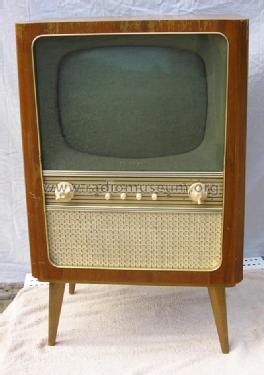
The image size is (264, 375). I want to click on left knob, so click(x=62, y=196).